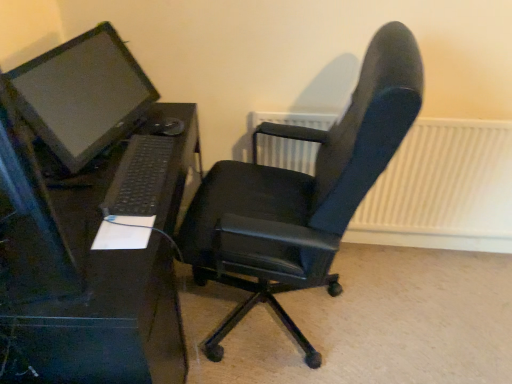
Question: Is black plastic desk at left inside or outside of matte black monitor at left?

Choices:
 (A) outside
 (B) inside

Answer: (A)

Question: Does point (55, 213) appear closer or farther from the camera than point (116, 62)?

Choices:
 (A) farther
 (B) closer

Answer: (B)

Question: Considering the real-world distances, which object is closest to the black plastic keyboard at lower left?

Choices:
 (A) black leather office chair at center
 (B) matte black monitor at left
 (C) black plastic desk at left
 (D) white textured radiator at upper right

Answer: (C)

Question: Which is farther from the matte black monitor at left?

Choices:
 (A) black leather office chair at center
 (B) black plastic desk at left
 (C) black plastic keyboard at lower left
 (D) white textured radiator at upper right

Answer: (D)